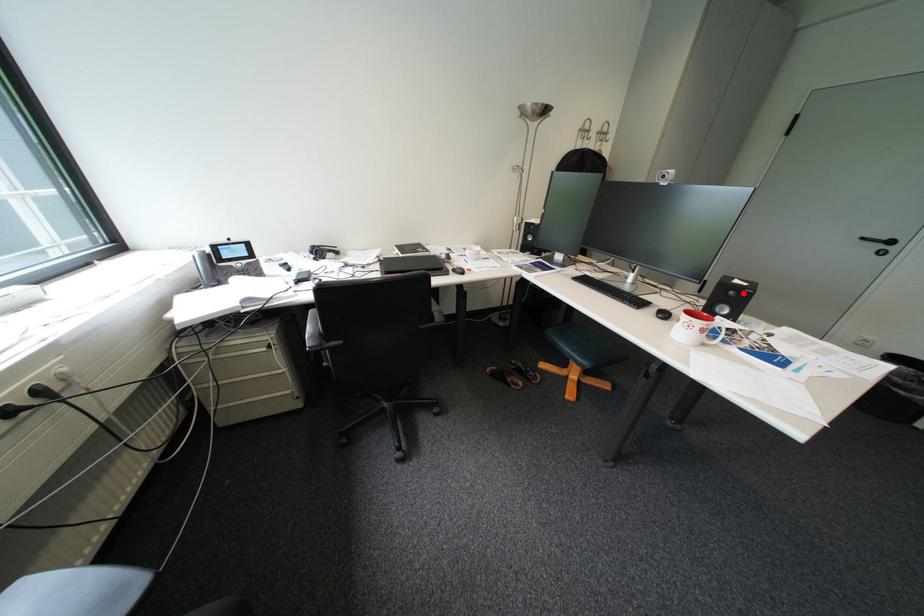
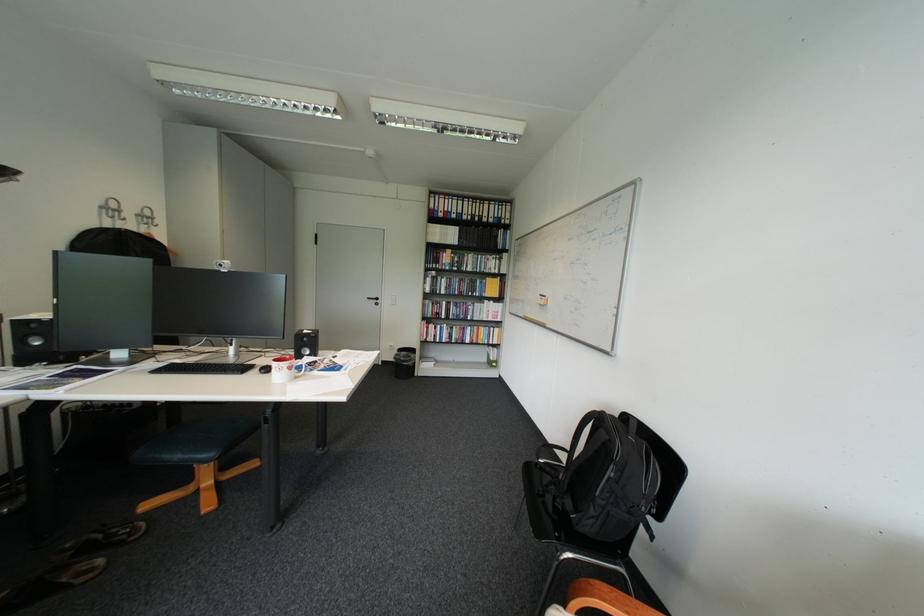
Question: A red point is marked in image1. In image2, is the corresponding 3D point closer to the camera or farther? Reply with the corresponding letter.

Choices:
 (A) The corresponding 3D point is closer.
 (B) The corresponding 3D point is farther.

Answer: (A)